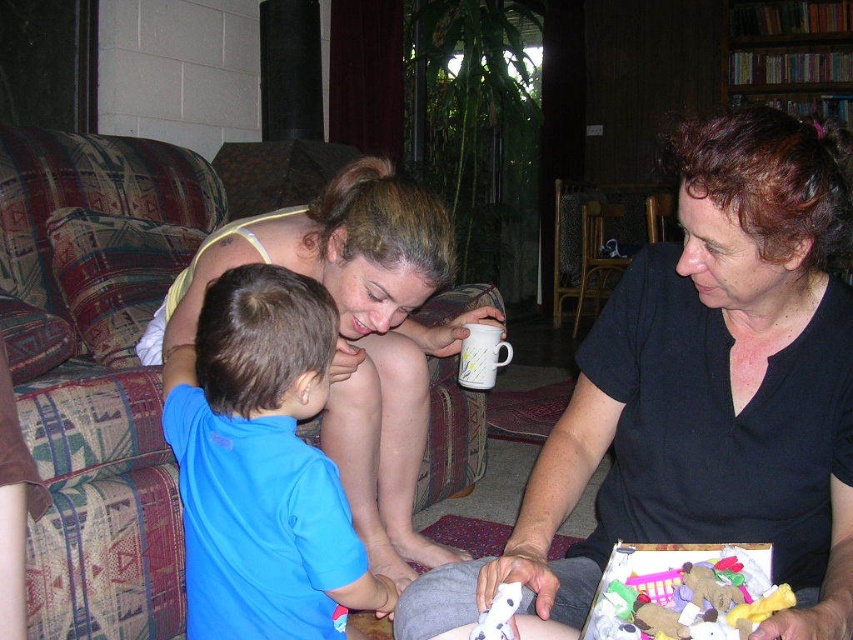
Question: Is blue cotton shirt at center above soft plush toys at lower right?

Choices:
 (A) yes
 (B) no

Answer: (A)

Question: Which object is the closest to the gray fabric at lower center?

Choices:
 (A) matte black shirt at center
 (B) black matte shirt at lower right

Answer: (B)

Question: Does soft plush toys at lower right lie in front of gray fabric at lower center?

Choices:
 (A) no
 (B) yes

Answer: (B)

Question: Can you confirm if black matte shirt at lower right is thinner than matte black shirt at center?

Choices:
 (A) no
 (B) yes

Answer: (B)

Question: Which object is positioned closest to the white ceramic mug at center?

Choices:
 (A) blue cotton shirt at center
 (B) white plastic toy at lower center
 (C) soft plush toys at lower right

Answer: (A)

Question: Which object is the farthest from the black matte shirt at lower right?

Choices:
 (A) white plastic toy at lower center
 (B) blue cotton shirt at center
 (C) gray fabric at lower center

Answer: (B)